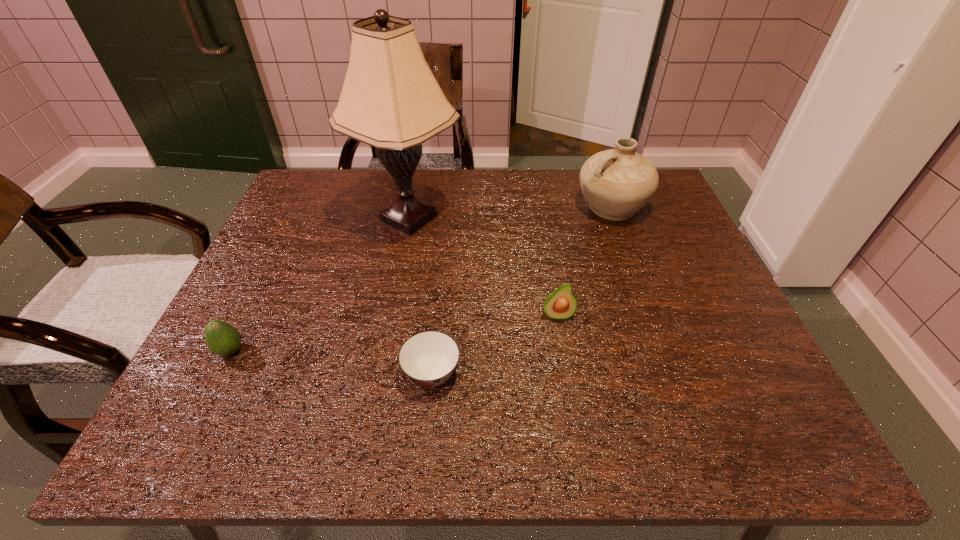
You are a GUI agent. You are given a task and a screenshot of the screen. Output one action in this format:
    pyautogui.click(x=<x>, y=<y>)
    Task: Click on the tallest object
    
    Given the screenshot: What is the action you would take?
    pyautogui.click(x=390, y=99)

Where is `the rightmost object`? the rightmost object is located at coordinates (616, 183).

At what (x,y) coordinates should I click in order to perform the action: click on pottery. Please return your answer as a coordinate pair (x, y). This screenshot has height=540, width=960. Looking at the image, I should click on (616, 183).

At what (x,y) coordinates should I click in order to perform the action: click on the right avocado. Please return your answer as a coordinate pair (x, y). Looking at the image, I should click on (561, 304).

I want to click on the third farthest object, so click(561, 304).

The height and width of the screenshot is (540, 960). In order to click on the second shortest object in this screenshot , I will do `click(223, 339)`.

This screenshot has width=960, height=540. Find the location of `the shorter avocado`. the shorter avocado is located at coordinates (223, 339).

Locate an element on the screen. This screenshot has height=540, width=960. soup bowl is located at coordinates (428, 358).

The image size is (960, 540). I want to click on blank space located 0.180m on the left of the tallest object, so click(289, 218).

The height and width of the screenshot is (540, 960). Find the location of `vacant region located on the front of the pottery`. vacant region located on the front of the pottery is located at coordinates (635, 270).